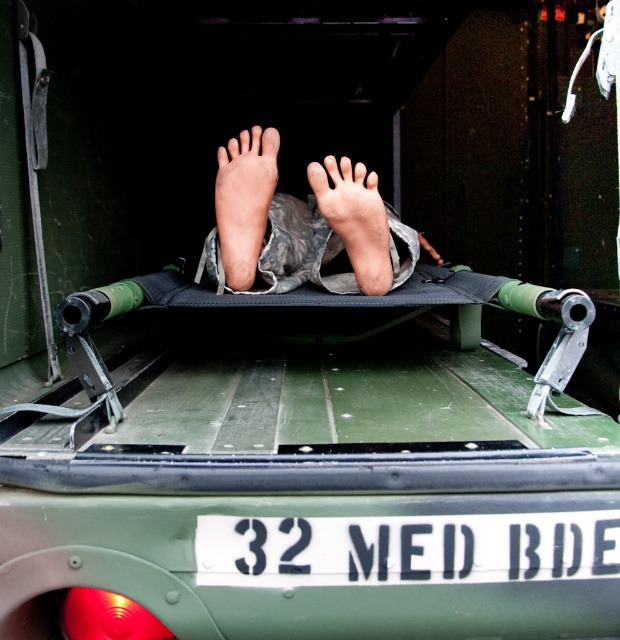
Which is more to the left, skinny legs at center or pale skin foot at center?

pale skin foot at center is more to the left.

Can you confirm if skinny legs at center is smaller than pale skin foot at center?

No, skinny legs at center is not smaller than pale skin foot at center.

Is point (386, 230) more distant than point (237, 220)?

No, (386, 230) is closer to viewer.

Locate an element on the screen. This screenshot has width=620, height=640. skinny legs at center is located at coordinates (303, 221).

Between white plastic license plate at center and camouflage fabric foot at center, which one has less height?

With less height is white plastic license plate at center.

Who is positioned more to the left, white plastic license plate at center or camouflage fabric foot at center?

Positioned to the left is camouflage fabric foot at center.

In order to click on white plastic license plate at center in this screenshot , I will do `click(405, 548)`.

Locate an element on the screen. The width and height of the screenshot is (620, 640). white plastic license plate at center is located at coordinates (405, 548).

Is white plastic license plate at center thinner than skinny legs at center?

Yes.

Is point (275, 577) in front of point (347, 196)?

Yes.

The image size is (620, 640). What do you see at coordinates (405, 548) in the screenshot? I see `white plastic license plate at center` at bounding box center [405, 548].

Where is `white plastic license plate at center`? white plastic license plate at center is located at coordinates (405, 548).